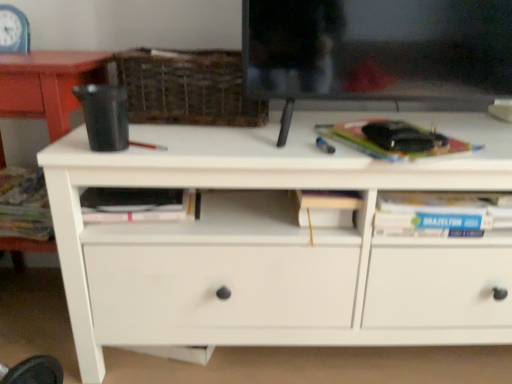
Question: From a real-world perspective, is white matte chest of drawers at center on top of blue plastic clock at upper left?

Choices:
 (A) no
 (B) yes

Answer: (A)

Question: Does white matte chest of drawers at center contain blue plastic clock at upper left?

Choices:
 (A) yes
 (B) no

Answer: (B)

Question: Considering the relative positions of white matte chest of drawers at center and blue plastic clock at upper left in the image provided, is white matte chest of drawers at center to the right of blue plastic clock at upper left from the viewer's perspective?

Choices:
 (A) yes
 (B) no

Answer: (A)

Question: Considering the relative sizes of white matte chest of drawers at center and blue plastic clock at upper left in the image provided, is white matte chest of drawers at center smaller than blue plastic clock at upper left?

Choices:
 (A) no
 (B) yes

Answer: (A)

Question: Is white matte chest of drawers at center looking in the opposite direction of blue plastic clock at upper left?

Choices:
 (A) no
 (B) yes

Answer: (A)

Question: From the image's perspective, is woven brown basket at upper center positioned above or below blue plastic clock at upper left?

Choices:
 (A) above
 (B) below

Answer: (B)

Question: Considering the positions of point (241, 125) and point (10, 13), is point (241, 125) closer or farther from the camera than point (10, 13)?

Choices:
 (A) closer
 (B) farther

Answer: (A)

Question: Considering the positions of woven brown basket at upper center and blue plastic clock at upper left in the image, is woven brown basket at upper center wider or thinner than blue plastic clock at upper left?

Choices:
 (A) thin
 (B) wide

Answer: (B)

Question: Visually, is woven brown basket at upper center positioned to the left or to the right of blue plastic clock at upper left?

Choices:
 (A) left
 (B) right

Answer: (B)

Question: Looking at their shapes, would you say blue plastic clock at upper left is wider or thinner than woven brown basket at upper center?

Choices:
 (A) wide
 (B) thin

Answer: (B)

Question: From the image's perspective, is blue plastic clock at upper left positioned above or below woven brown basket at upper center?

Choices:
 (A) above
 (B) below

Answer: (A)

Question: Considering the positions of point (17, 34) and point (145, 74), is point (17, 34) closer or farther from the camera than point (145, 74)?

Choices:
 (A) closer
 (B) farther

Answer: (B)

Question: Is blue plastic clock at upper left to the left or to the right of woven brown basket at upper center in the image?

Choices:
 (A) right
 (B) left

Answer: (B)

Question: From a real-world perspective, is woven brown basket at upper center physically located above or below white matte chest of drawers at center?

Choices:
 (A) above
 (B) below

Answer: (A)

Question: Is woven brown basket at upper center situated inside white matte chest of drawers at center or outside?

Choices:
 (A) inside
 (B) outside

Answer: (B)